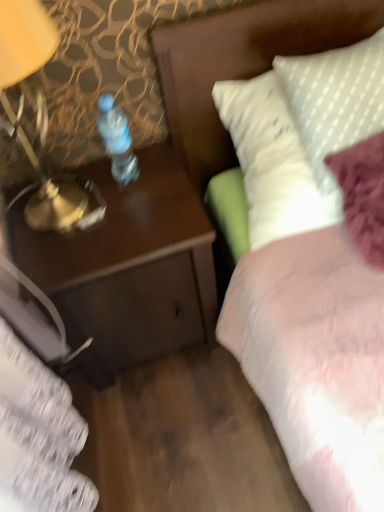
Where is `vacant area that lies between gold metallic lamp at left and clear plastic bottle at center`? The width and height of the screenshot is (384, 512). vacant area that lies between gold metallic lamp at left and clear plastic bottle at center is located at coordinates (127, 195).